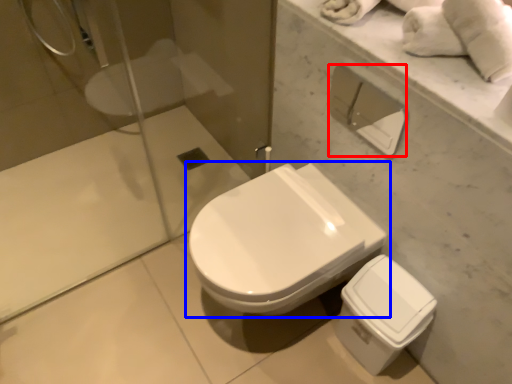
Question: Which point is further to the camera, toilet paper (highlighted by a red box) or toilet (highlighted by a blue box)?

Choices:
 (A) toilet paper
 (B) toilet

Answer: (B)